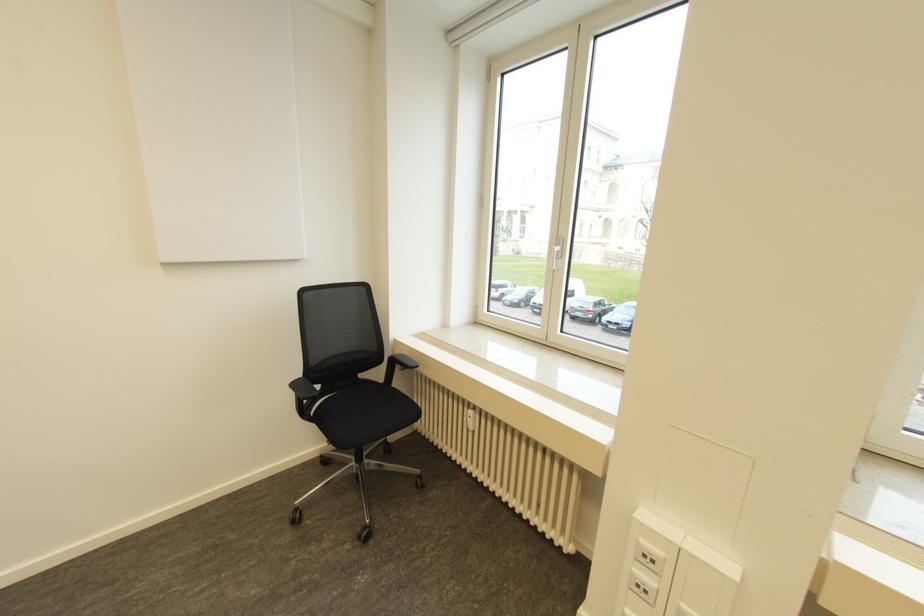
This screenshot has width=924, height=616. In order to click on white window handle in this screenshot , I will do `click(555, 253)`.